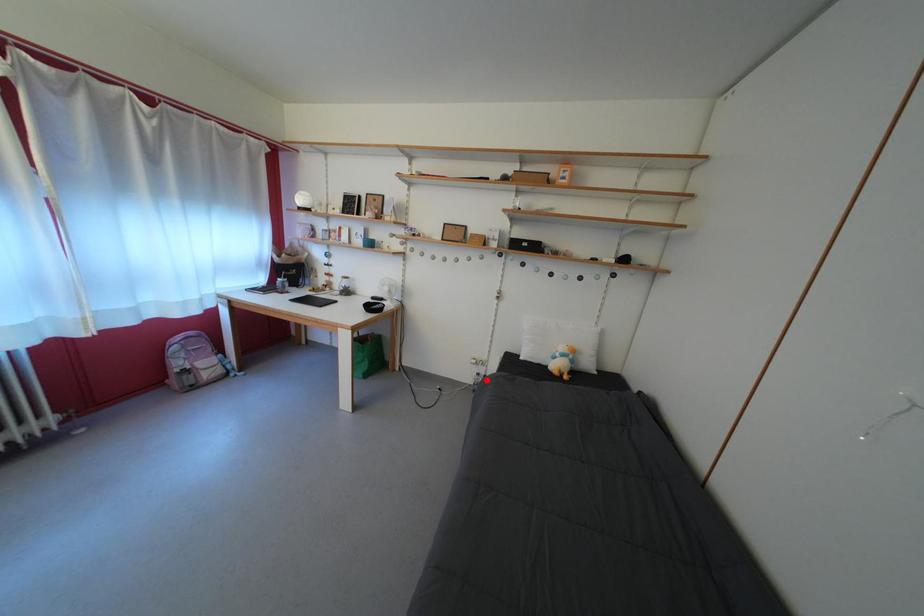
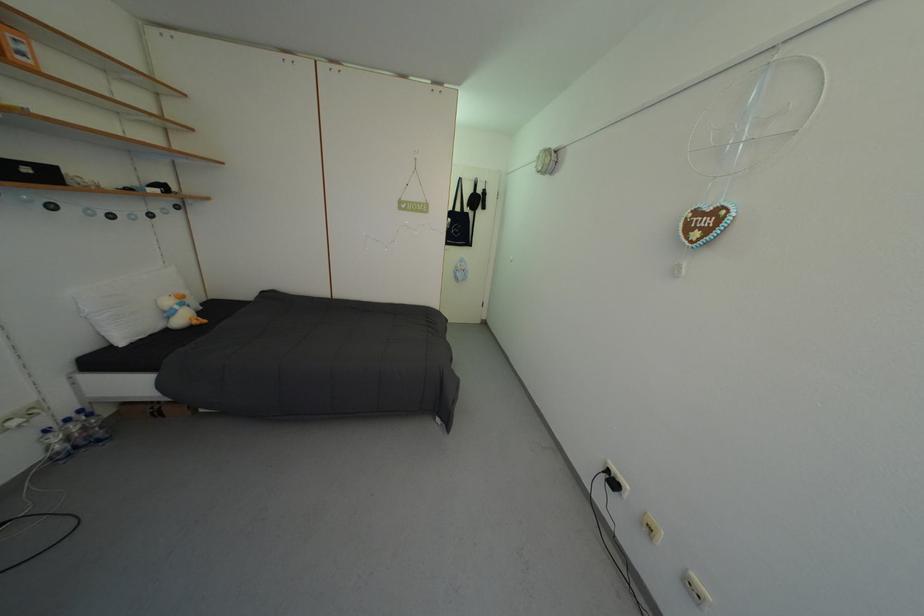
Locate, in the second image, the point that corresponds to the highlighted location in the first image.

(55, 437)